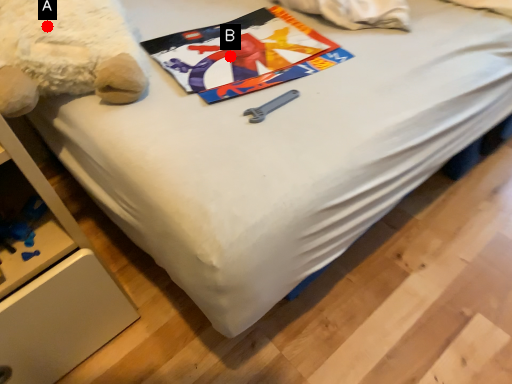
Question: Two points are circled on the image, labeled by A and B beside each circle. Which point is closer to the camera taking this photo?

Choices:
 (A) A is closer
 (B) B is closer

Answer: (A)